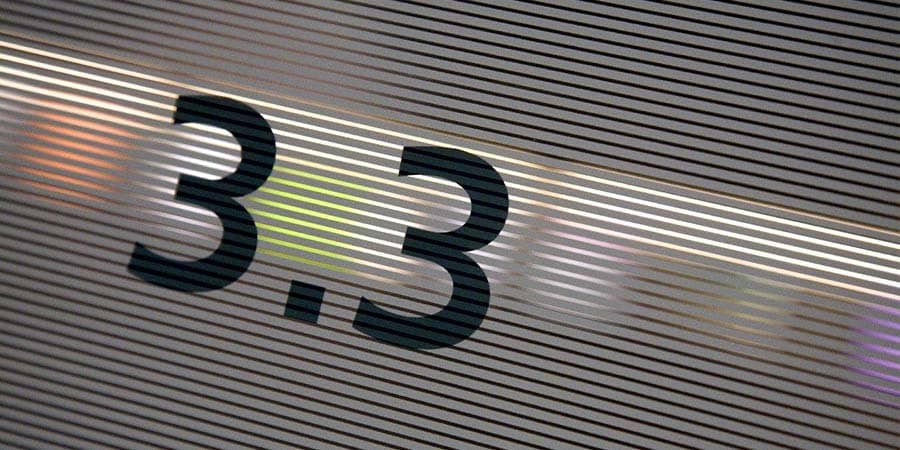
Find the location of a particular element. table is located at coordinates (621, 113).